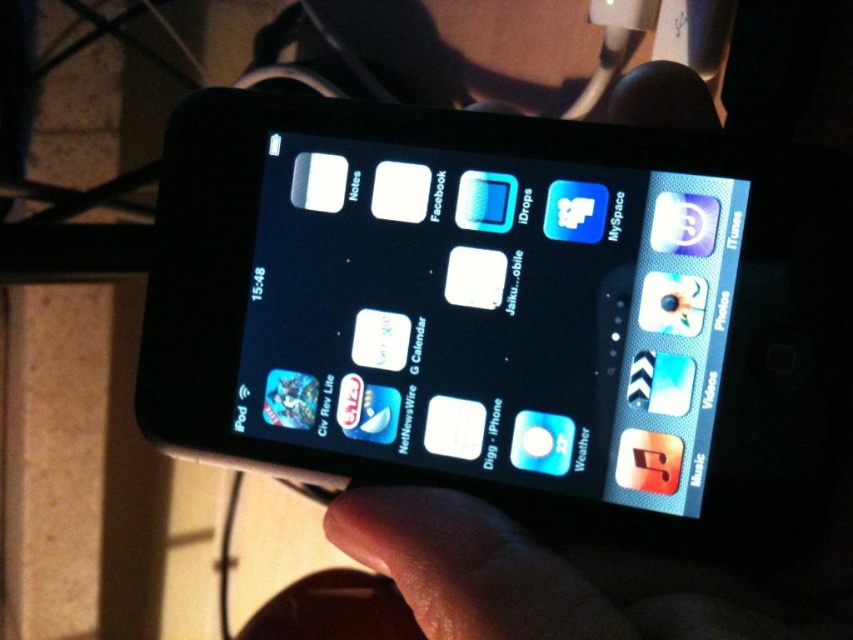
Who is positioned more to the right, black plastic smartphone at center or black matte hand at center?

black matte hand at center

Which of these two, black plastic smartphone at center or black matte hand at center, stands shorter?

black matte hand at center

The width and height of the screenshot is (853, 640). I want to click on black plastic smartphone at center, so click(440, 298).